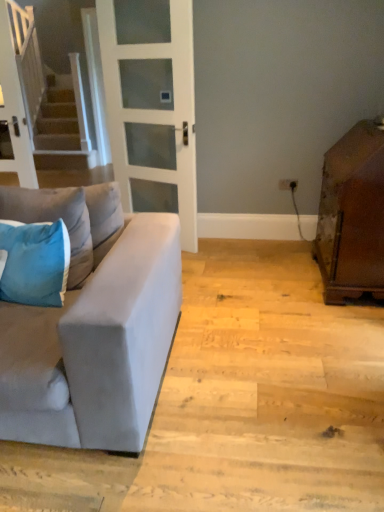
Question: From the image's perspective, is blue velvet pillow at left, arranged as the 1th pillow when viewed from the top, over brown wooden cabinet at right?

Choices:
 (A) no
 (B) yes

Answer: (A)

Question: Does blue velvet pillow at left, which is the second pillow from bottom to top, contain brown wooden cabinet at right?

Choices:
 (A) no
 (B) yes

Answer: (A)

Question: Does blue velvet pillow at left, arranged as the 1th pillow when viewed from the top, have a larger size compared to brown wooden cabinet at right?

Choices:
 (A) yes
 (B) no

Answer: (B)

Question: Is blue velvet pillow at left, which is the second pillow from bottom to top, to the right of brown wooden cabinet at right from the viewer's perspective?

Choices:
 (A) no
 (B) yes

Answer: (A)

Question: From the image's perspective, is blue velvet pillow at left, arranged as the 1th pillow when viewed from the top, below brown wooden cabinet at right?

Choices:
 (A) yes
 (B) no

Answer: (A)

Question: From the image's perspective, is blue velvet pillow at left, which is the second pillow from bottom to top, positioned above or below suede gray couch at left?

Choices:
 (A) above
 (B) below

Answer: (A)

Question: Is point (16, 198) closer or farther from the camera than point (145, 226)?

Choices:
 (A) farther
 (B) closer

Answer: (B)

Question: Is blue velvet pillow at left, arranged as the 1th pillow when viewed from the top, to the left or to the right of suede gray couch at left in the image?

Choices:
 (A) right
 (B) left

Answer: (B)

Question: From their relative heights in the image, would you say blue velvet pillow at left, arranged as the 1th pillow when viewed from the top, is taller or shorter than suede gray couch at left?

Choices:
 (A) tall
 (B) short

Answer: (B)

Question: In the image, is blue fabric pillow at left, the first pillow in the bottom-to-top sequence, on the left side or the right side of suede gray couch at left?

Choices:
 (A) right
 (B) left

Answer: (B)

Question: From the image's perspective, is blue fabric pillow at left, the first pillow in the bottom-to-top sequence, located above or below suede gray couch at left?

Choices:
 (A) below
 (B) above

Answer: (B)

Question: Does point tap(59, 245) appear closer or farther from the camera than point tap(160, 330)?

Choices:
 (A) closer
 (B) farther

Answer: (B)

Question: From a real-world perspective, is blue fabric pillow at left, placed as the 2th pillow when sorted from top to bottom, positioned above or below suede gray couch at left?

Choices:
 (A) above
 (B) below

Answer: (A)

Question: Is blue fabric pillow at left, the first pillow in the bottom-to-top sequence, taller or shorter than blue velvet pillow at left, which is the second pillow from bottom to top?

Choices:
 (A) short
 (B) tall

Answer: (A)

Question: Is blue fabric pillow at left, the first pillow in the bottom-to-top sequence, wider or thinner than blue velvet pillow at left, arranged as the 1th pillow when viewed from the top?

Choices:
 (A) wide
 (B) thin

Answer: (B)